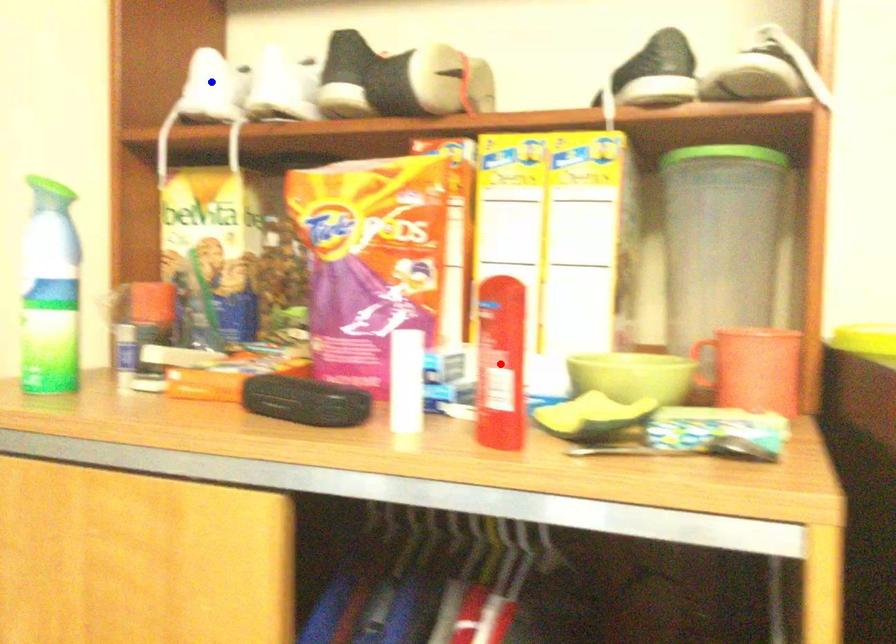
Question: In the image, two points are highlighted. Which point is nearer to the camera? Reply with the corresponding letter.

Choices:
 (A) blue point
 (B) red point

Answer: (B)